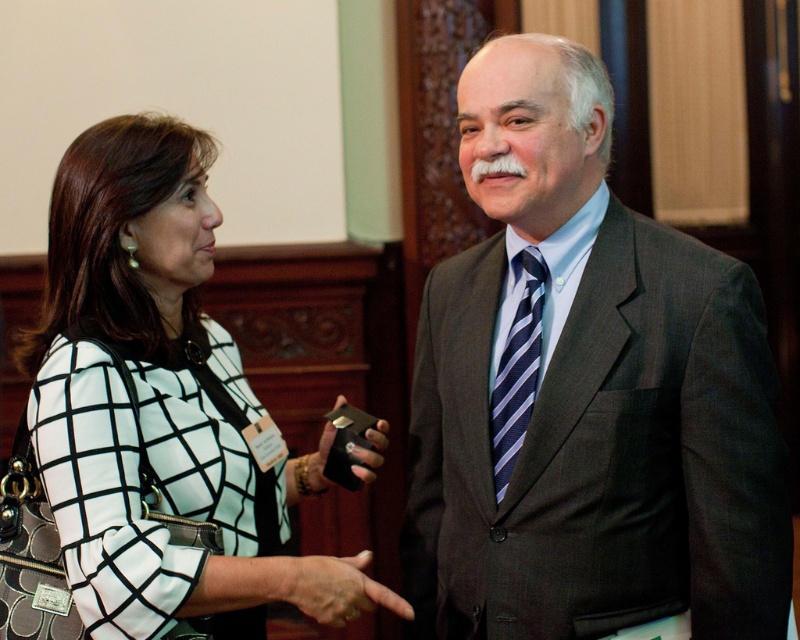
Question: Observing the image, what is the correct spatial positioning of white checkered blazer at center in reference to blue striped tie at center?

Choices:
 (A) above
 (B) below

Answer: (B)

Question: Considering the real-world distances, which object is farthest from the blue striped tie at center?

Choices:
 (A) white checkered blazer at center
 (B) black leather wallet at center

Answer: (A)

Question: Based on their relative distances, which object is farther from the white checkered blazer at center?

Choices:
 (A) leather textured hand at center
 (B) dark gray suit at center
 (C) black leather wallet at center

Answer: (B)

Question: Can you confirm if dark gray suit at center is thinner than leather textured hand at center?

Choices:
 (A) no
 (B) yes

Answer: (A)

Question: Which of the following is the farthest from the observer?

Choices:
 (A) (358, 426)
 (B) (88, 557)

Answer: (A)

Question: Does dark gray suit at center come behind black leather wallet at center?

Choices:
 (A) no
 (B) yes

Answer: (A)